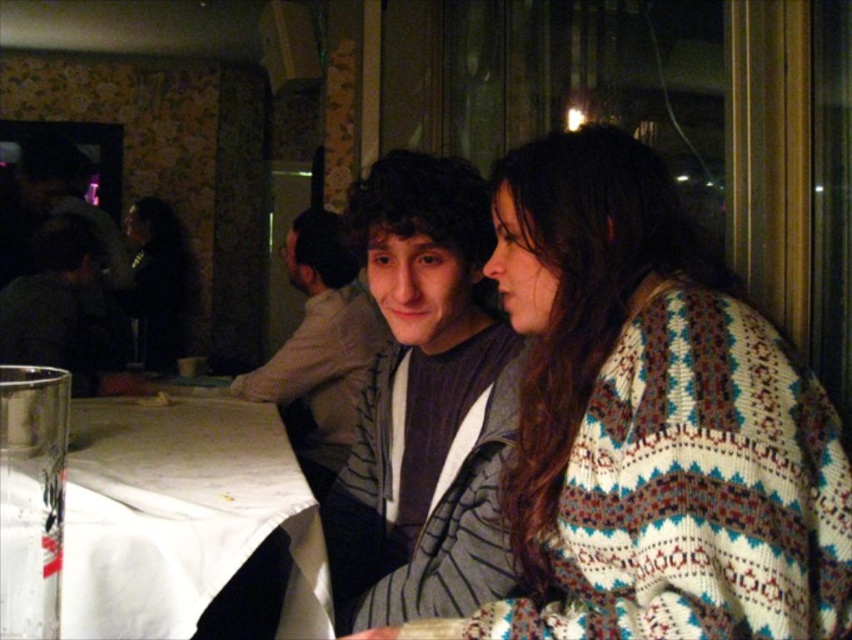
Question: Can you confirm if gray striped jacket at center is positioned to the left of white cloth at lower left?

Choices:
 (A) no
 (B) yes

Answer: (A)

Question: Among these points, which one is farthest from the camera?

Choices:
 (A) (441, 518)
 (B) (311, 260)

Answer: (B)

Question: Which point is farther to the camera?

Choices:
 (A) gray striped shirt at center
 (B) white cloth at lower left
 (C) gray striped jacket at center

Answer: (A)

Question: Does white knitted sweater at center appear on the right side of white cloth at lower left?

Choices:
 (A) no
 (B) yes

Answer: (B)

Question: Is gray striped jacket at center positioned in front of gray striped shirt at center?

Choices:
 (A) no
 (B) yes

Answer: (B)

Question: Which object appears farthest from the camera in this image?

Choices:
 (A) gray striped shirt at center
 (B) white knitted sweater at center
 (C) gray striped jacket at center
 (D) white cloth at lower left

Answer: (A)